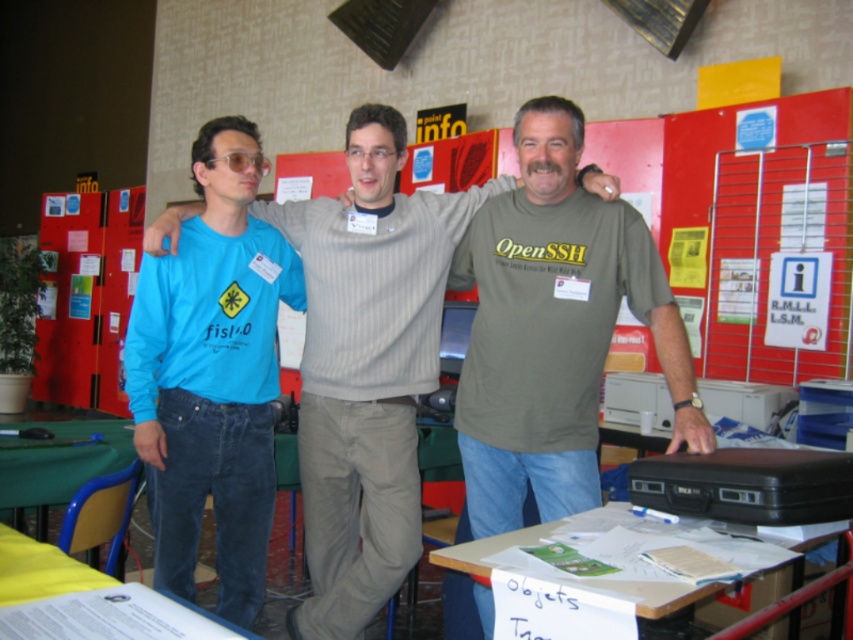
Question: Does matte gray shirt at center appear over white paper at lower center?

Choices:
 (A) yes
 (B) no

Answer: (A)

Question: Which point is closer to the camera?

Choices:
 (A) matte gray shirt at center
 (B) matte blue shirt at left
 (C) green fabric table at lower left
 (D) light gray sweater at center

Answer: (A)

Question: Among these objects, which one is farthest from the camera?

Choices:
 (A) green fabric table at lower left
 (B) matte plastic glasses at left
 (C) light gray sweater at center
 (D) white paper at lower center

Answer: (A)

Question: Which object is positioned closest to the matte blue shirt at left?

Choices:
 (A) yellow paper at lower left
 (B) white paper at lower center
 (C) matte plastic glasses at left
 (D) light gray sweater at center

Answer: (D)

Question: In this image, where is green fabric table at lower left located relative to yellow paper at lower left?

Choices:
 (A) below
 (B) above

Answer: (A)

Question: Can you confirm if light gray sweater at center is wider than matte blue shirt at left?

Choices:
 (A) yes
 (B) no

Answer: (A)